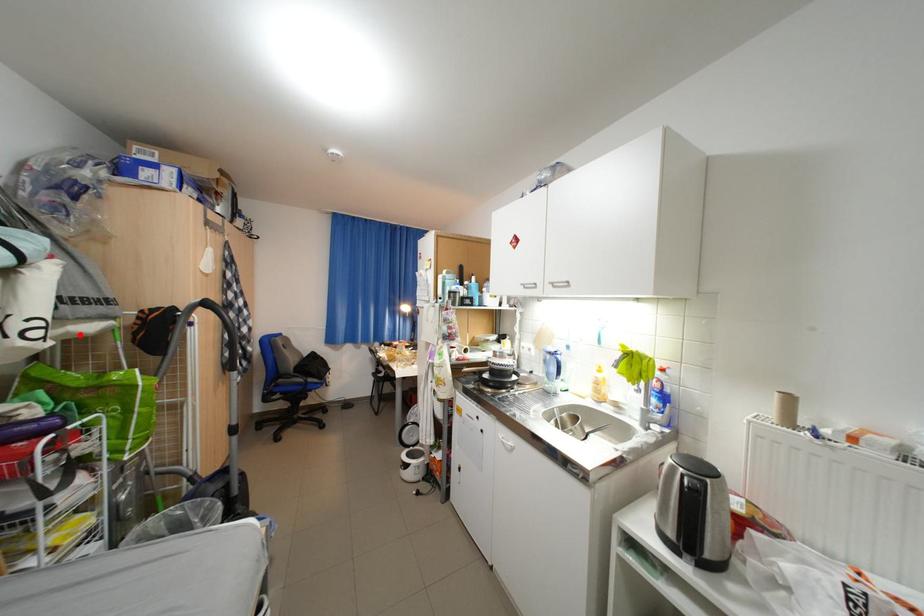
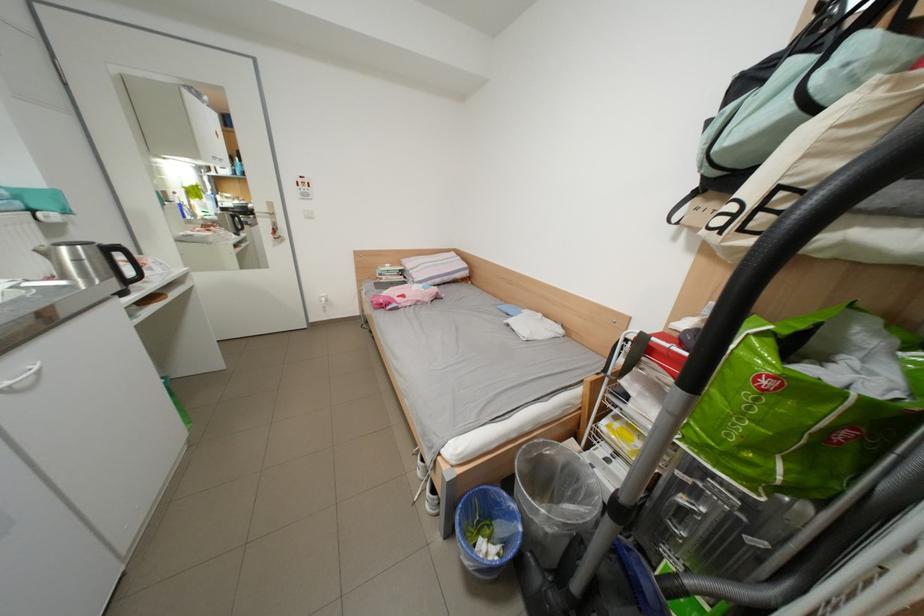
In the second image, find the point that corresponds to the highlighted location in the first image.

(856, 245)